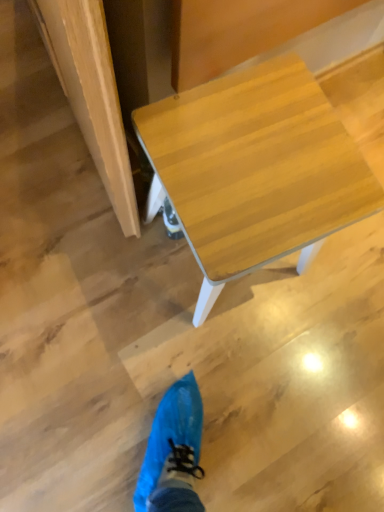
In order to click on blank space situated above light wood table at center (from a real-world perspective) in this screenshot , I will do `click(249, 161)`.